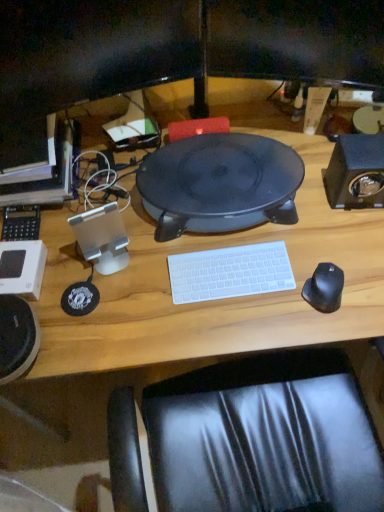
This screenshot has width=384, height=512. Identify the location of space that is in front of black matte speaker at right. (348, 241).